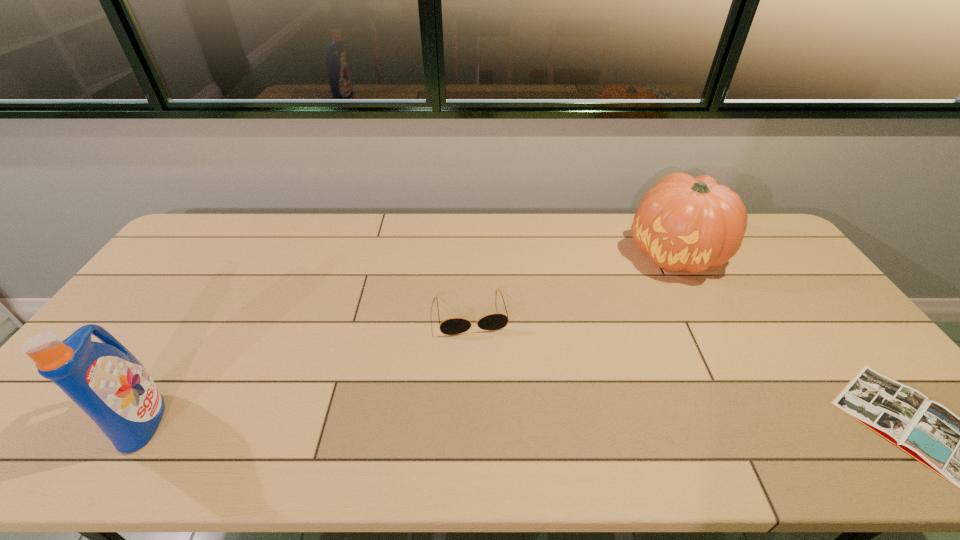
What are the coordinates of `vacant space that is in between the third tallest object and the pumpkin` in the screenshot? It's located at (573, 283).

Where is `free point between the second tallest object and the detergent`? The image size is (960, 540). free point between the second tallest object and the detergent is located at coordinates (409, 336).

In order to click on vacant space that's between the sunglasses and the tallest object in this screenshot , I will do `click(307, 366)`.

I want to click on empty space between the sunglasses and the tallest object, so point(307,366).

Identify which object is the second nearest to the tallest object. Please provide its 2D coordinates. Your answer should be formatted as a tuple, i.e. [(x, y)], where the tuple contains the x and y coordinates of a point satisfying the conditions above.

[(683, 223)]

Image resolution: width=960 pixels, height=540 pixels. Identify the location of the second closest object to the second object from left to right. (105, 380).